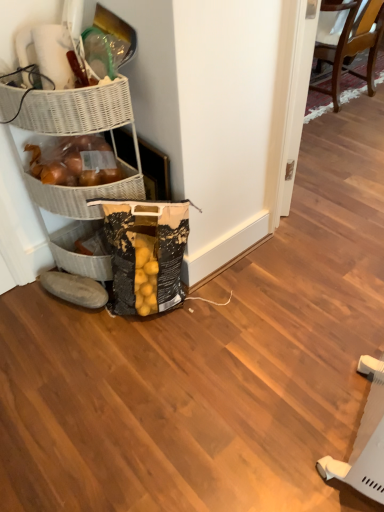
The height and width of the screenshot is (512, 384). I want to click on free space in front of gray fabric slipper at lower left, so click(66, 336).